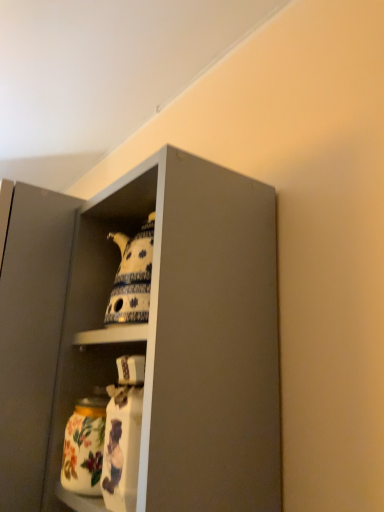
Question: Relative to matte gray cabinet at upper center, is porcelain teapot at upper center, which is the 2th cabinet from left to right, in front or behind?

Choices:
 (A) front
 (B) behind

Answer: (B)

Question: From a real-world perspective, is porcelain teapot at upper center, which is counted as the 1th cabinet, starting from the right, above or below matte gray cabinet at upper center?

Choices:
 (A) above
 (B) below

Answer: (A)

Question: Estimate the real-world distances between objects in this image. Which object is closer to the porcelain teapot at upper center, which is the 2th cabinet from left to right?

Choices:
 (A) porcelain teapot at upper center, which is the second cabinet in right-to-left order
 (B) matte gray cabinet at upper center
 (C) floral ceramic jar at lower left

Answer: (A)

Question: Considering the real-world distances, which object is closest to the floral ceramic jar at lower left?

Choices:
 (A) matte gray cabinet at upper center
 (B) porcelain teapot at upper center, which is the second cabinet in right-to-left order
 (C) porcelain teapot at upper center, which is counted as the 1th cabinet, starting from the right

Answer: (B)